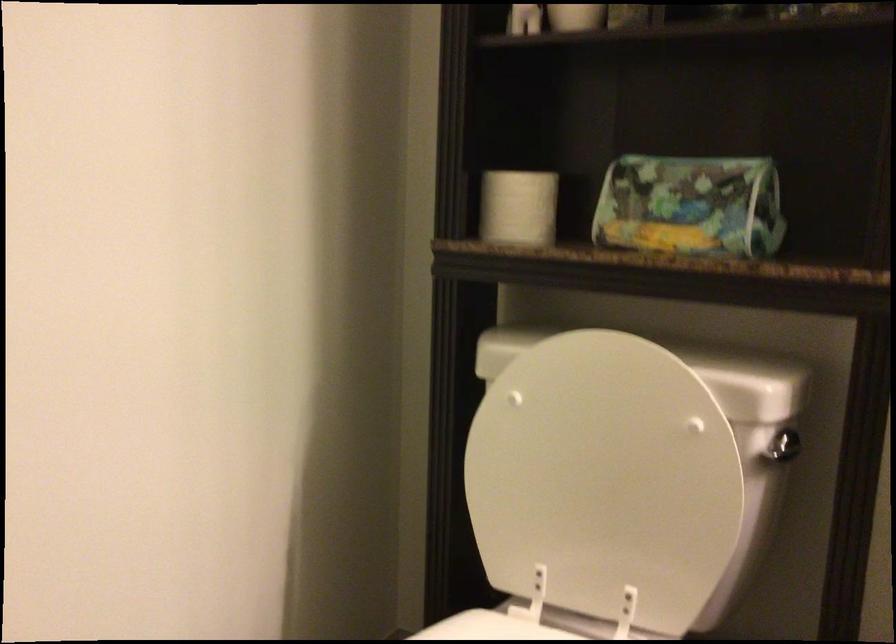
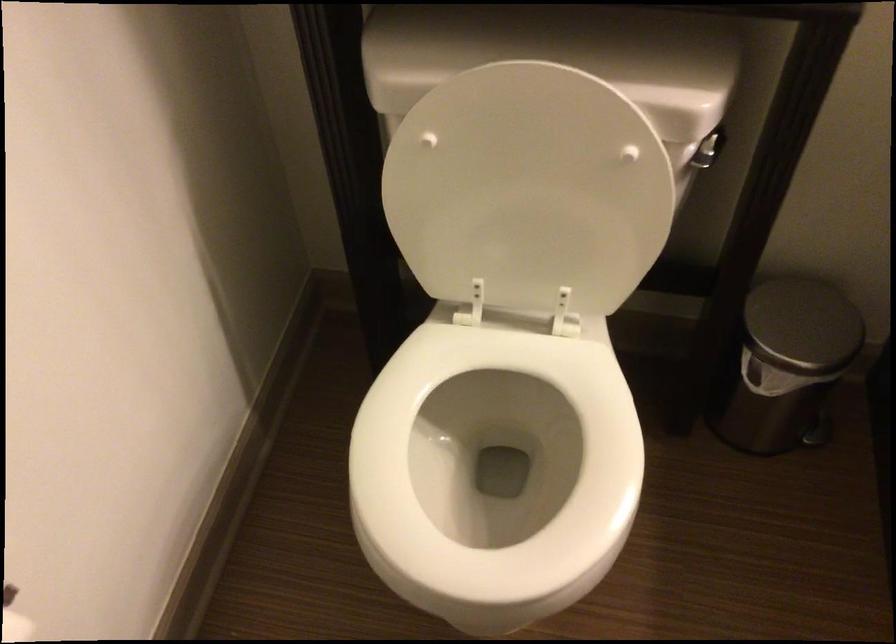
In the second image, find the point that corresponds to point (605, 462) in the first image.

(528, 189)